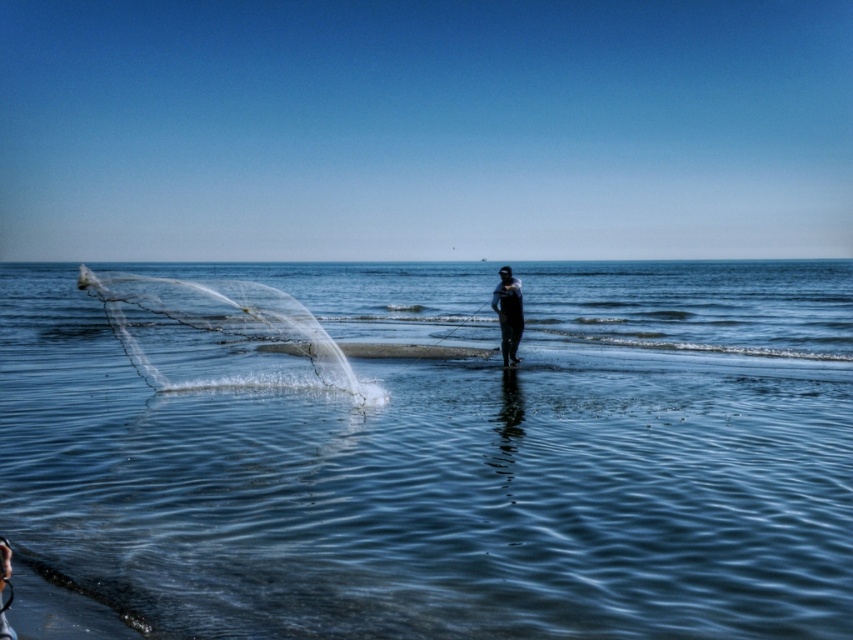
You are a photographer trying to capture the net in the coastal scene. The net is at point (x=218, y=333). If your camera focuses on the center of the image, will the net be centered?

The transparent nylon net at left is located at point (x=218, y=333), so it is not centered in the image. The center of the image is at point 0.5, 0.5, so the net is slightly to the right and below the center.

You are a photographer trying to capture the reflection of the transparent nylon net at left in the clear water at center. Based on the scene, do you think the reflection will be fully visible in the water?

The clear water at center might be wider than transparent nylon net at left, so the reflection of the transparent nylon net at left may not be fully visible in the clear water at center due to the water being wider.

You are a photographer trying to capture the net and the water in the same frame. Since you want the transparent nylon net at left to be in focus, where should you position the camera relative to the clear water at center?

The clear water at center is to the right of the transparent nylon net at left, so you should position the camera to the right side of the transparent nylon net at left to ensure it stays in focus while also capturing the clear water at center in the frame.